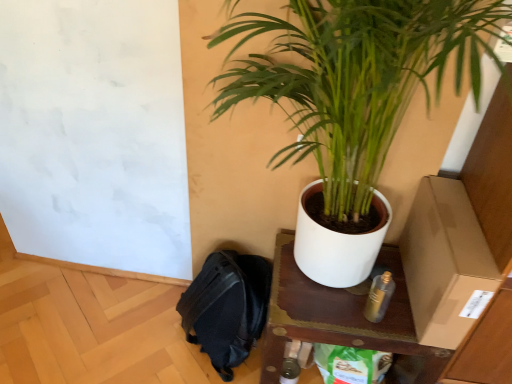
Question: Is brown cardboard box at right shorter than black fabric backpack at lower left?

Choices:
 (A) no
 (B) yes

Answer: (B)

Question: Is brown cardboard box at right bigger than black fabric backpack at lower left?

Choices:
 (A) no
 (B) yes

Answer: (A)

Question: From a real-world perspective, is brown cardboard box at right under black fabric backpack at lower left?

Choices:
 (A) no
 (B) yes

Answer: (A)

Question: Is brown cardboard box at right oriented towards black fabric backpack at lower left?

Choices:
 (A) no
 (B) yes

Answer: (A)

Question: Does brown cardboard box at right appear on the right side of black fabric backpack at lower left?

Choices:
 (A) no
 (B) yes

Answer: (B)

Question: Is brown cardboard box at right thinner than black fabric backpack at lower left?

Choices:
 (A) no
 (B) yes

Answer: (A)

Question: From a real-world perspective, is brown cardboard box at right below wooden table at center?

Choices:
 (A) no
 (B) yes

Answer: (A)

Question: From the image's perspective, is brown cardboard box at right beneath wooden table at center?

Choices:
 (A) no
 (B) yes

Answer: (A)

Question: Can you confirm if brown cardboard box at right is positioned to the right of wooden table at center?

Choices:
 (A) no
 (B) yes

Answer: (B)

Question: Considering the relative sizes of brown cardboard box at right and wooden table at center in the image provided, is brown cardboard box at right shorter than wooden table at center?

Choices:
 (A) yes
 (B) no

Answer: (A)

Question: Is brown cardboard box at right thinner than wooden table at center?

Choices:
 (A) yes
 (B) no

Answer: (A)

Question: Is the position of brown cardboard box at right less distant than that of wooden table at center?

Choices:
 (A) yes
 (B) no

Answer: (A)

Question: From the image's perspective, would you say green glossy plant at upper right is shown under brown cardboard box at right?

Choices:
 (A) yes
 (B) no

Answer: (B)